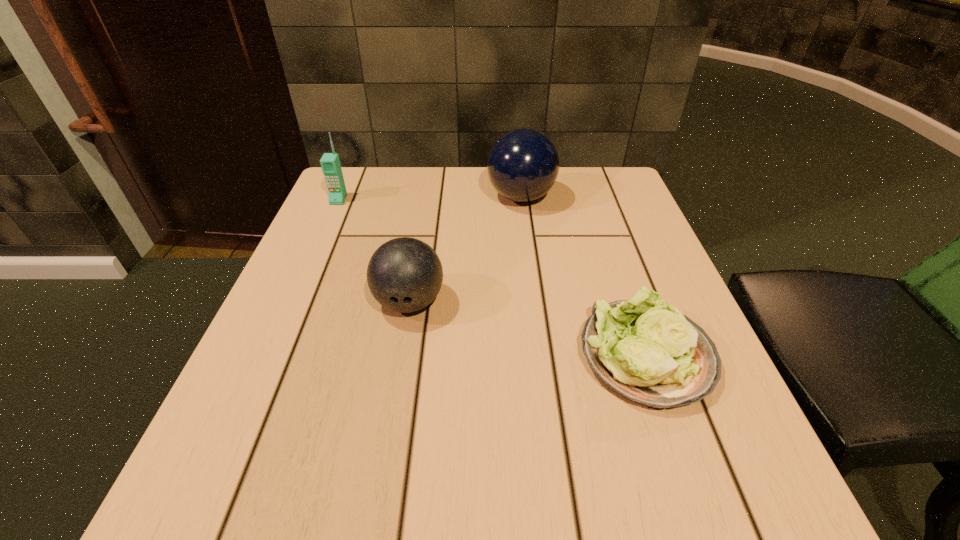
Identify the location of free spot between the right bowling ball and the shortest object. The height and width of the screenshot is (540, 960). (584, 276).

This screenshot has height=540, width=960. I want to click on free space between the shortest object and the leftmost object, so click(x=492, y=278).

Identify which object is the closest to the right bowling ball. Please provide its 2D coordinates. Your answer should be formatted as a tuple, i.e. [(x, y)], where the tuple contains the x and y coordinates of a point satisfying the conditions above.

[(404, 274)]

Identify the location of object that is the closest one to the nearer bowling ball. The image size is (960, 540). pos(523,165).

Where is `free space in the image that satisfies the following two spatial constraints: 1. on the surface of the farther bowling ball near the finger holes; 2. on the left side of the shortest object`? free space in the image that satisfies the following two spatial constraints: 1. on the surface of the farther bowling ball near the finger holes; 2. on the left side of the shortest object is located at coordinates (541, 356).

Where is `vacant space that satisfies the following two spatial constraints: 1. on the surface of the shortest object near the finger holes; 2. on the right side of the right bowling ball`? The image size is (960, 540). vacant space that satisfies the following two spatial constraints: 1. on the surface of the shortest object near the finger holes; 2. on the right side of the right bowling ball is located at coordinates (541, 356).

At what (x,y) coordinates should I click in order to perform the action: click on free space in the image that satisfies the following two spatial constraints: 1. on the grip area of the shorter bowling ball; 2. on the right side of the shortest object. Please return your answer as a coordinate pair (x, y). Looking at the image, I should click on (400, 356).

The height and width of the screenshot is (540, 960). What are the coordinates of `blank space that satisfies the following two spatial constraints: 1. on the surface of the right bowling ball near the finger holes; 2. on the keypad of the leftmost object` in the screenshot? It's located at (521, 200).

Where is `vacant region that satisfies the following two spatial constraints: 1. on the grip area of the shortest object; 2. on the right side of the shorter bowling ball`? Image resolution: width=960 pixels, height=540 pixels. vacant region that satisfies the following two spatial constraints: 1. on the grip area of the shortest object; 2. on the right side of the shorter bowling ball is located at coordinates (400, 356).

Find the location of a particular element. This screenshot has height=540, width=960. vacant space that satisfies the following two spatial constraints: 1. on the surface of the farther bowling ball near the finger holes; 2. on the keypad of the cellular telephone is located at coordinates (521, 200).